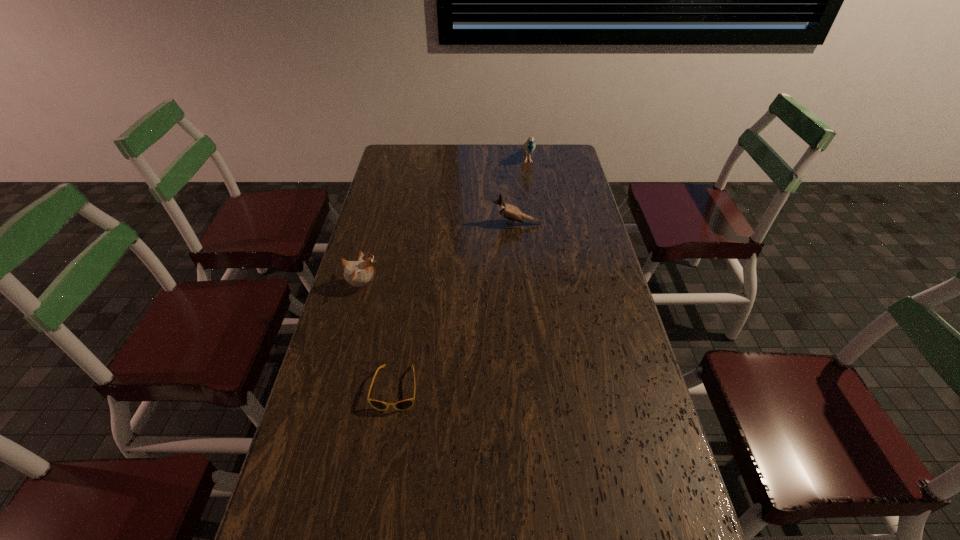
You are a GUI agent. You are given a task and a screenshot of the screen. Output one action in this format:
    pyautogui.click(x=<x>, y=<y>)
    Task: Click on the farthest bird
    The height and width of the screenshot is (540, 960).
    Given the screenshot: What is the action you would take?
    pyautogui.click(x=529, y=146)

The image size is (960, 540). What are the coordinates of `the second nearest bird` in the screenshot? It's located at (509, 212).

The width and height of the screenshot is (960, 540). In order to click on the nearest bird in this screenshot , I will do `click(357, 273)`.

Where is `the third farthest object`? Image resolution: width=960 pixels, height=540 pixels. the third farthest object is located at coordinates tap(357, 273).

Where is `the nearest object`? the nearest object is located at coordinates (402, 405).

I want to click on sunglasses, so click(x=402, y=405).

Locate an element on the screen. free space located at the face of the farthest bird is located at coordinates (532, 185).

Find the location of a particular element. The width and height of the screenshot is (960, 540). vacant space located 0.170m at the face of the second nearest bird is located at coordinates (447, 224).

Where is `vacant space situated 0.250m at the face of the second nearest bird`? vacant space situated 0.250m at the face of the second nearest bird is located at coordinates (426, 224).

Find the location of a particular element. The height and width of the screenshot is (540, 960). vacant space situated at the face of the second nearest bird is located at coordinates (457, 224).